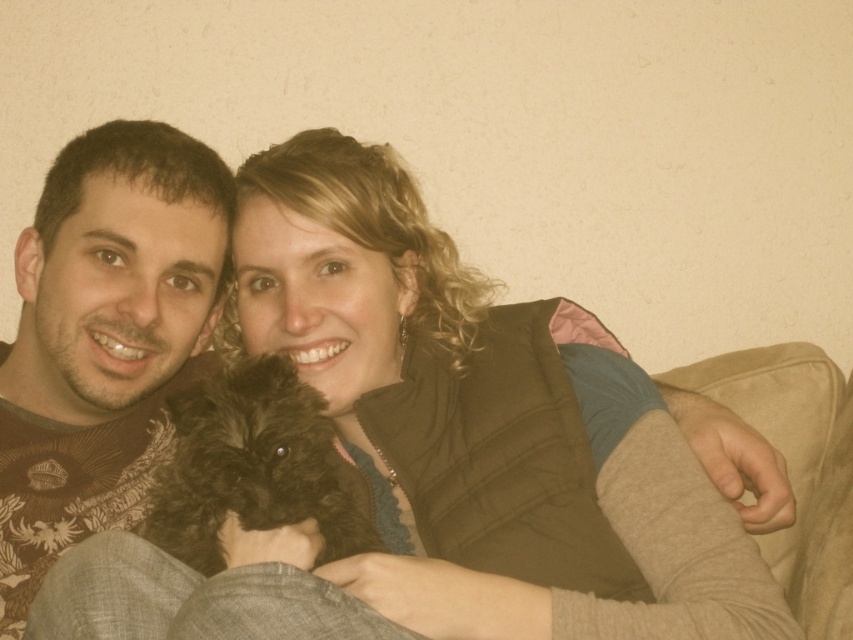
Measure the distance from dark brown sweater at left to black fluffy dog at center.

dark brown sweater at left and black fluffy dog at center are 8.24 inches apart.

Looking at this image, can you confirm if dark brown sweater at left is smaller than black fluffy dog at center?

Actually, dark brown sweater at left might be larger than black fluffy dog at center.

In order to click on dark brown sweater at left in this screenshot , I will do `click(102, 337)`.